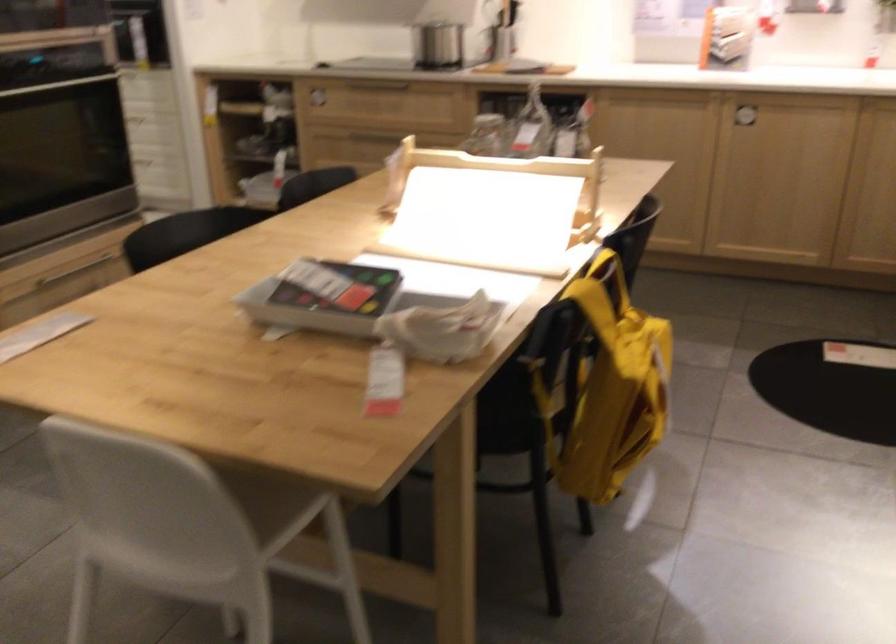
Locate an element on the screen. The width and height of the screenshot is (896, 644). cabinet handle is located at coordinates (745, 118).